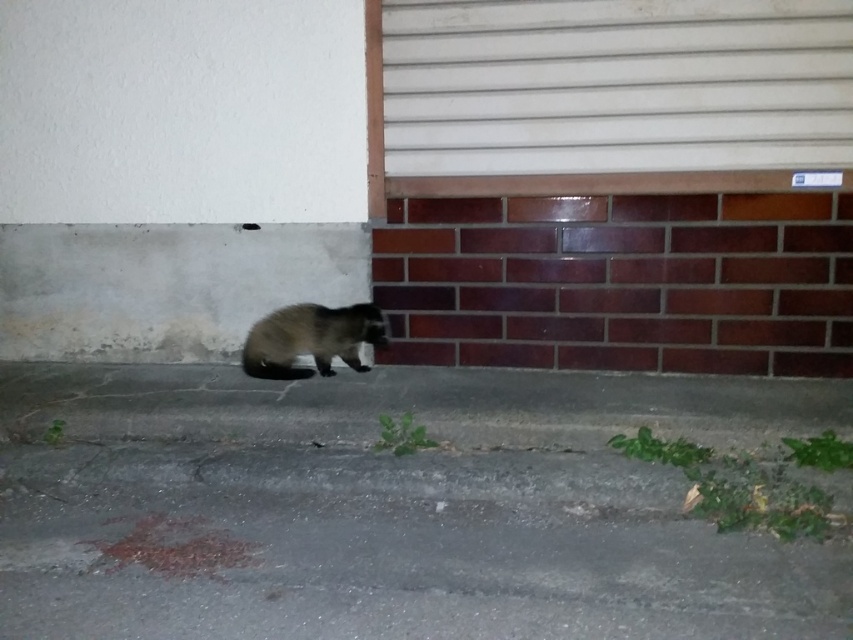
Question: Which object is positioned farthest from the fuzzy brown fur at lower center?

Choices:
 (A) white matte garage door at upper center
 (B) gray asphalt pavement at lower center

Answer: (A)

Question: Where is gray asphalt pavement at lower center located in relation to fuzzy brown fur at lower center in the image?

Choices:
 (A) above
 (B) below

Answer: (B)

Question: Can you confirm if white matte garage door at upper center is positioned below fuzzy brown fur at lower center?

Choices:
 (A) no
 (B) yes

Answer: (A)

Question: Among these points, which one is nearest to the camera?

Choices:
 (A) (670, 541)
 (B) (546, 433)
 (C) (619, 67)
 (D) (242, 364)

Answer: (A)

Question: Is gray asphalt pavement at lower center wider than white matte garage door at upper center?

Choices:
 (A) no
 (B) yes

Answer: (B)

Question: Which of the following is the farthest from the observer?

Choices:
 (A) (831, 20)
 (B) (525, 406)

Answer: (A)